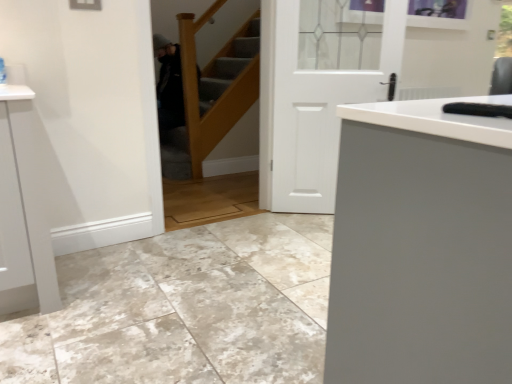
This screenshot has width=512, height=384. I want to click on empty space that is in between white wooden door at center and wooden stairwell at center, so click(x=255, y=224).